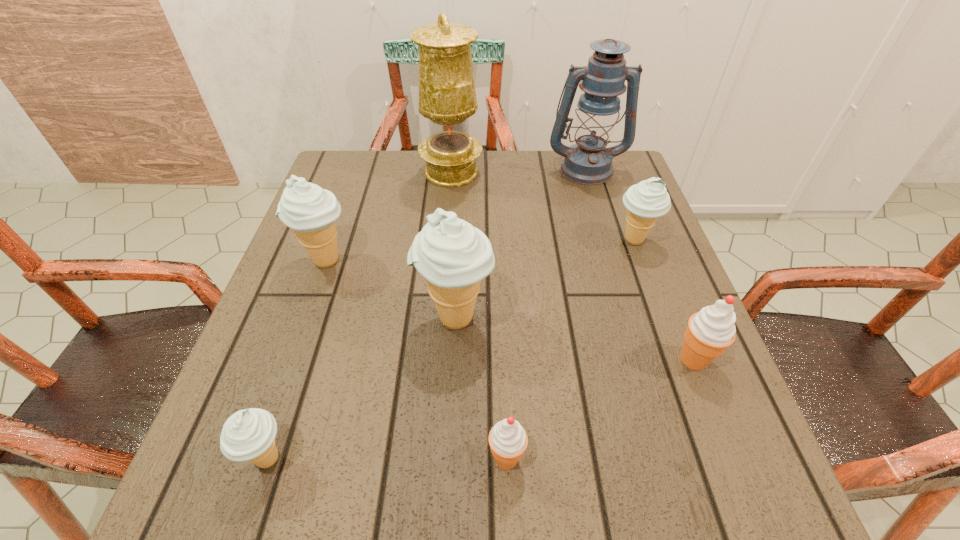
At what (x,y) coordinates should I click in order to perform the action: click on oil lamp at the far edge. Please return your answer as a coordinate pair (x, y). This screenshot has height=540, width=960. Looking at the image, I should click on (447, 97).

Find the location of `lantern situated at the far edge`. lantern situated at the far edge is located at coordinates (589, 162).

The height and width of the screenshot is (540, 960). In order to click on lantern situated at the right edge in this screenshot , I will do `click(589, 162)`.

At what (x,y) coordinates should I click in order to perform the action: click on object present at the near left corner. Please return your answer as a coordinate pair (x, y). Looking at the image, I should click on (249, 435).

The height and width of the screenshot is (540, 960). Find the location of `object present at the far right corner`. object present at the far right corner is located at coordinates (589, 162).

In the image, there is a desktop. What are the coordinates of `free space at the far edge` in the screenshot? It's located at (567, 201).

Find the location of a particular element. vacant space at the near edge is located at coordinates (468, 509).

The image size is (960, 540). In order to click on free space at the left edge of the desktop in this screenshot , I will do `click(281, 426)`.

At what (x,y) coordinates should I click in order to perform the action: click on free location at the right edge of the desktop. Please return your answer as a coordinate pair (x, y). This screenshot has width=960, height=540. Looking at the image, I should click on (652, 342).

You are a GUI agent. You are given a task and a screenshot of the screen. Output one action in this format:
    pyautogui.click(x=<x>, y=<y>)
    Task: Click on the free location at the far left corner of the desktop
    
    Given the screenshot: What is the action you would take?
    pyautogui.click(x=371, y=156)